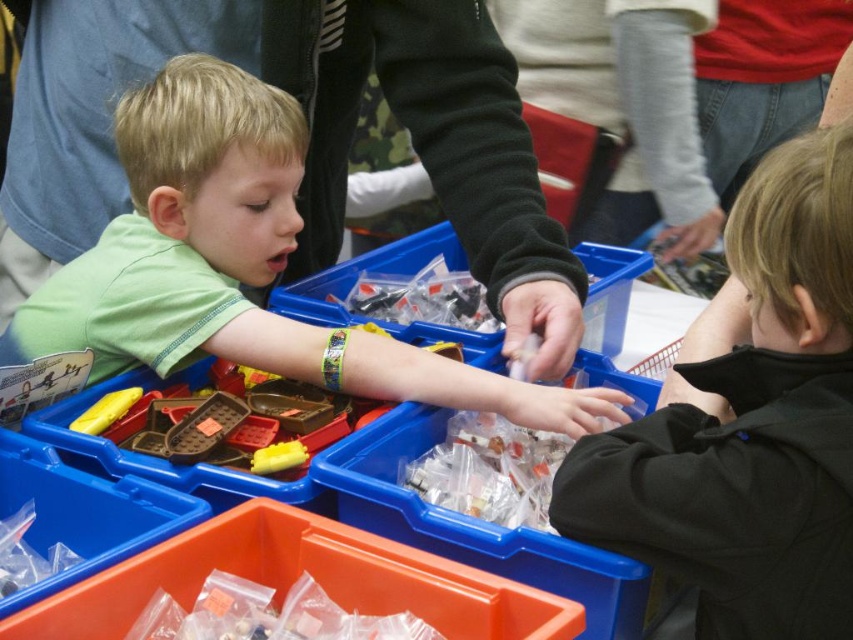
Question: Among these objects, which one is nearest to the camera?

Choices:
 (A) black matte jacket at right
 (B) translucent plastic bag at center

Answer: (A)

Question: Can you confirm if green matte shirt at center is bigger than translucent plastic bag at center?

Choices:
 (A) no
 (B) yes

Answer: (B)

Question: From the image, what is the correct spatial relationship of black matte jacket at right in relation to translucent plastic bag at center?

Choices:
 (A) above
 (B) below

Answer: (A)

Question: Among these points, which one is farthest from the camera?

Choices:
 (A) (401, 483)
 (B) (343, 355)

Answer: (B)

Question: Which of these objects is positioned closest to the black matte jacket at right?

Choices:
 (A) translucent plastic bag at center
 (B) green matte shirt at center

Answer: (A)

Question: Does black matte jacket at right appear over translucent plastic bag at center?

Choices:
 (A) yes
 (B) no

Answer: (A)